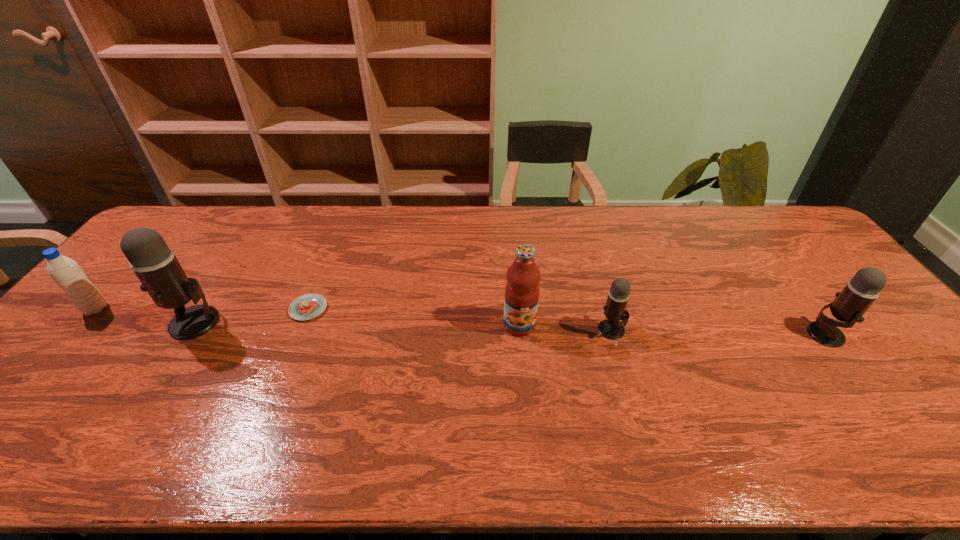
Locate an element on the screen. free spot located 0.200m on the left of the second object from left to right is located at coordinates [x=97, y=322].

The width and height of the screenshot is (960, 540). I want to click on free space located on the back of the second microphone from left to right, so click(x=599, y=287).

In order to click on free spot located 0.060m on the front of the rightmost microphone in this screenshot , I will do `click(851, 368)`.

I want to click on vacant point located on the left of the shortest object, so click(x=218, y=309).

I want to click on free location located on the front label of the fourth object from left to right, so (x=527, y=416).

Locate an element on the screen. This screenshot has width=960, height=540. free location located 0.280m on the right of the leftmost object is located at coordinates (207, 309).

What are the coordinates of `object that is at the left edge` in the screenshot? It's located at (67, 274).

Identify the location of object situated at the right edge. (850, 304).

In the image, there is a desktop. At what (x,y) coordinates should I click in order to perform the action: click on free region at the far edge. Please return your answer as a coordinate pair (x, y). This screenshot has width=960, height=540. Looking at the image, I should click on (452, 228).

Image resolution: width=960 pixels, height=540 pixels. What are the coordinates of `free space at the right edge` in the screenshot? It's located at (781, 258).